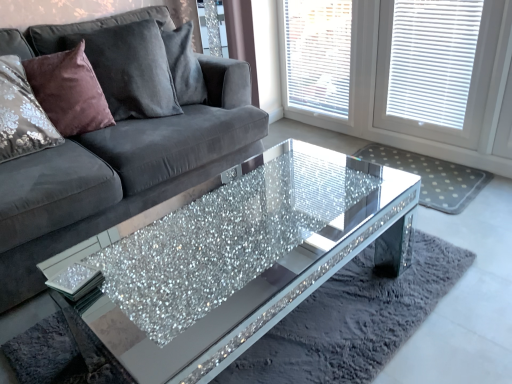
Where is `free space in front of white dotted mat at center`? free space in front of white dotted mat at center is located at coordinates (466, 231).